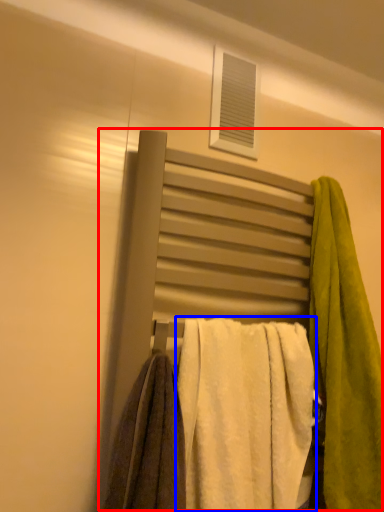
Question: Which object is closer to the camera taking this photo, bed (highlighted by a red box) or towel (highlighted by a blue box)?

Choices:
 (A) bed
 (B) towel

Answer: (B)